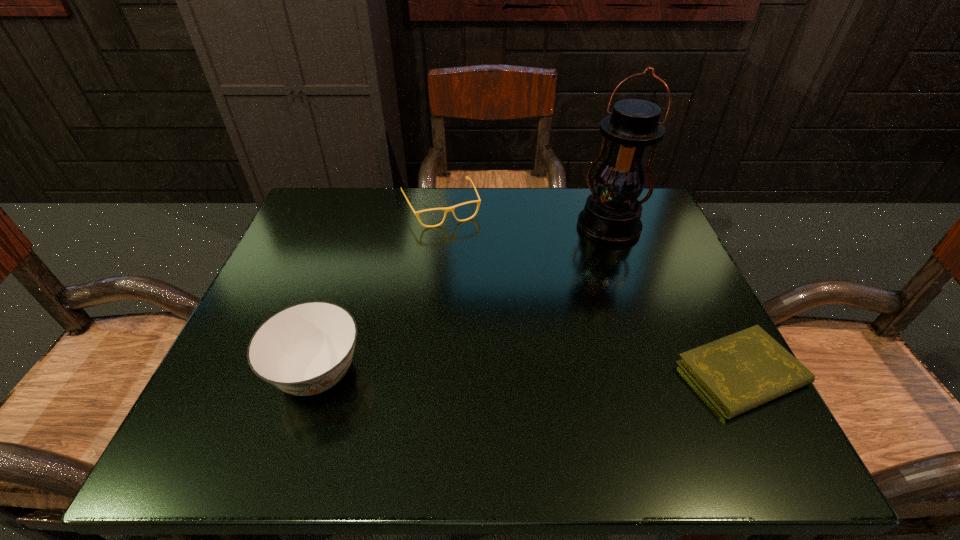
You are a GUI agent. You are given a task and a screenshot of the screen. Output one action in this format:
    pyautogui.click(x=<x>, y=<y>)
    Task: Click on the soup bowl
    This screenshot has width=960, height=540.
    Given the screenshot: What is the action you would take?
    pyautogui.click(x=305, y=349)

Where is `the shortest object`? This screenshot has height=540, width=960. the shortest object is located at coordinates (737, 373).

Locate an element on the screen. The image size is (960, 540). the tallest object is located at coordinates (611, 215).

You are a GUI agent. You are given a task and a screenshot of the screen. Output one action in this format:
    pyautogui.click(x=<x>, y=<y>)
    Task: Click on the spectacles
    
    Given the screenshot: What is the action you would take?
    447,209

Locate an element on the screen. This screenshot has width=960, height=540. vacant region located on the left of the soup bowl is located at coordinates (234, 373).

Where is `free spot located on the left of the shortest object`? This screenshot has height=540, width=960. free spot located on the left of the shortest object is located at coordinates (507, 374).

Locate several points within vacant space located above the lantern, indicating its light source. Please provide its 2D coordinates. Your answer should be formatted as a tuple, i.e. [(x, y)], where the tuple contains the x and y coordinates of a point satisfying the conditions above.

[(525, 371)]

Point to any free space located 0.390m above the lantern, indicating its light source in the image. Please provide its 2D coordinates. Your answer should be formatted as a tuple, i.e. [(x, y)], where the tuple contains the x and y coordinates of a point satisfying the conditions above.

[(528, 367)]

Identify a few spots in the free region located 0.280m above the lantern, indicating its light source. Please provide its 2D coordinates. Your answer should be formatted as a tuple, i.e. [(x, y)], where the tuple contains the x and y coordinates of a point satisfying the conditions above.

[(552, 325)]

You are a GUI agent. You are given a task and a screenshot of the screen. Output one action in this format:
    pyautogui.click(x=<x>, y=<y>)
    Task: Click on the vacant point located in front of the lenses of the third tallest object
    
    Given the screenshot: What is the action you would take?
    pyautogui.click(x=462, y=248)